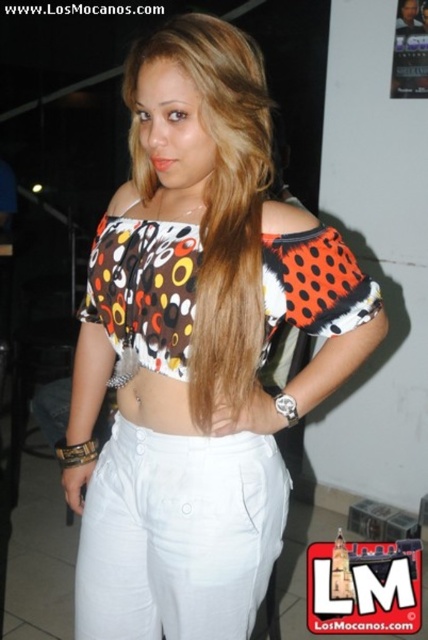
Is point (377, 324) less distant than point (252, 196)?

No, it is behind (252, 196).

Between point (157, 252) and point (244, 324), which one is positioned behind?

Point (157, 252)

Who is more forward, (131, 392) or (219, 275)?

Positioned in front is point (219, 275).

The height and width of the screenshot is (640, 428). I want to click on printed fabric bikini top at center, so click(146, 305).

Which is below, white cotton pants at center or printed fabric bikini top at center?

white cotton pants at center

Is white cotton pants at center smaller than printed fabric bikini top at center?

Correct, white cotton pants at center occupies less space than printed fabric bikini top at center.

Between point (140, 449) and point (195, 310), which one is positioned behind?

The point (140, 449) is behind.

Where is `white cotton pants at center`? white cotton pants at center is located at coordinates (178, 536).

Is white cotton pants at center above brown silky hair at center?

No, white cotton pants at center is not above brown silky hair at center.

Is white cotton pants at center positioned before brown silky hair at center?

No, white cotton pants at center is further to the viewer.

Is point (140, 444) closer to camera compared to point (216, 148)?

That is False.

Where is `white cotton pants at center`? white cotton pants at center is located at coordinates (178, 536).